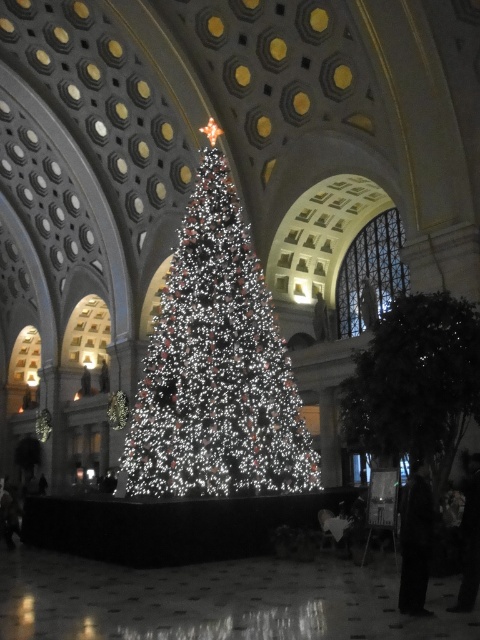
You are standing in the grand hall and want to take a photo of both the illuminated plastic christmas tree at center and the green matte tree at right. Which tree should you position yourself to the left of to capture both in the frame?

You should position yourself to the left of the green matte tree at right because the illuminated plastic christmas tree at center is to the left of it, allowing both trees to be in the frame.